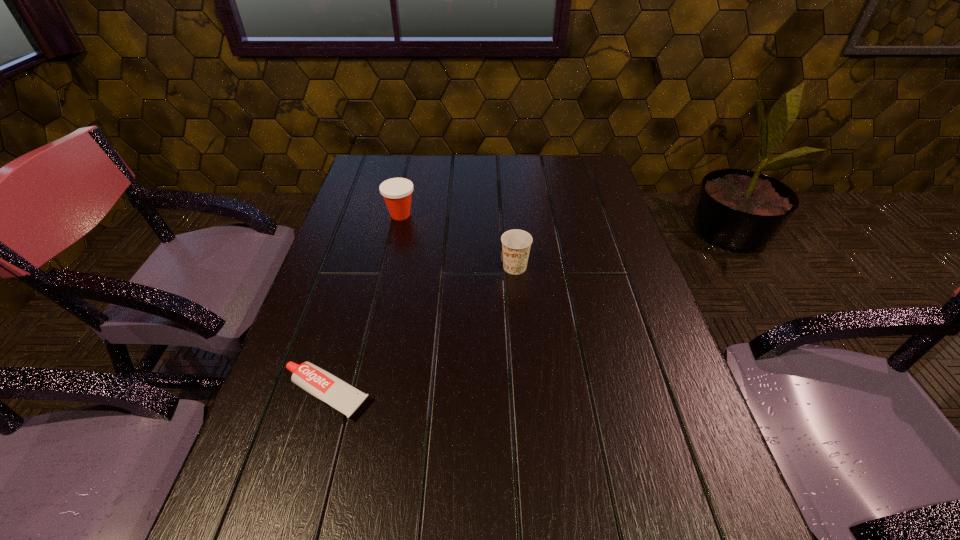
Locate an element on the screen. This screenshot has height=540, width=960. toothpaste at the left edge is located at coordinates point(321,384).

This screenshot has width=960, height=540. Identify the location of vacant space at the far edge of the desktop. (451, 170).

Locate an element on the screen. free space at the left edge of the desktop is located at coordinates (363, 218).

In the image, there is a desktop. Identify the location of vacant area at the right edge. (637, 270).

The image size is (960, 540). Find the location of `vacant space at the far left corner`. vacant space at the far left corner is located at coordinates (356, 179).

Image resolution: width=960 pixels, height=540 pixels. I want to click on vacant space at the far right corner of the desktop, so click(x=594, y=157).

You are a GUI agent. You are given a task and a screenshot of the screen. Output one action in this format:
    pyautogui.click(x=<x>, y=<y>)
    Task: Click on the vacant area between the nearest object and the farthest object
    
    Given the screenshot: What is the action you would take?
    pyautogui.click(x=363, y=305)

The width and height of the screenshot is (960, 540). I want to click on unoccupied area between the rightmost object and the farthest object, so (x=458, y=241).

Locate an element on the screen. vacant space that's between the left Dixie cup and the shortest object is located at coordinates (363, 305).

This screenshot has height=540, width=960. Identify the location of empty space that is in between the farthest object and the toothpaste. (363, 305).